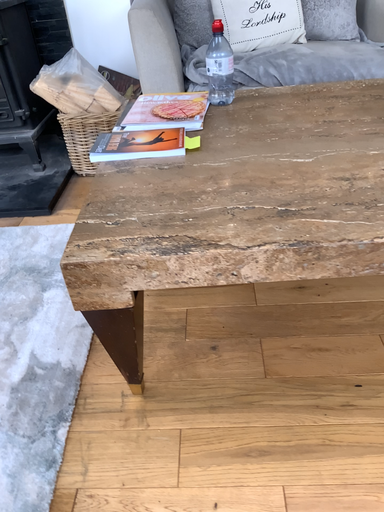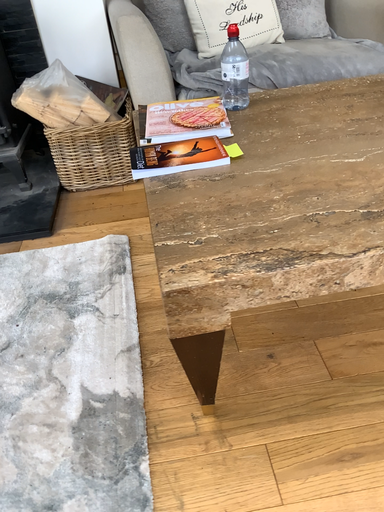
Question: Which way did the camera rotate in the video?

Choices:
 (A) rotated right
 (B) rotated left

Answer: (A)